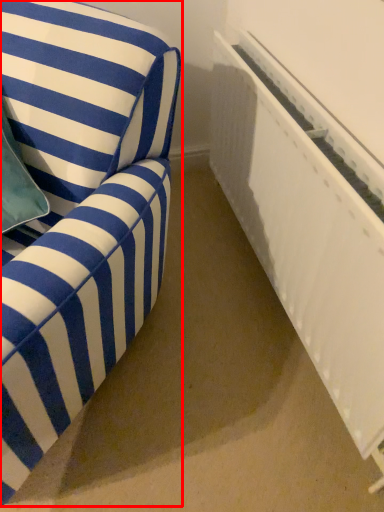
Question: From the image's perspective, what is the correct spatial relationship of furniture (annotated by the red box) in relation to radiator?

Choices:
 (A) below
 (B) above

Answer: (A)